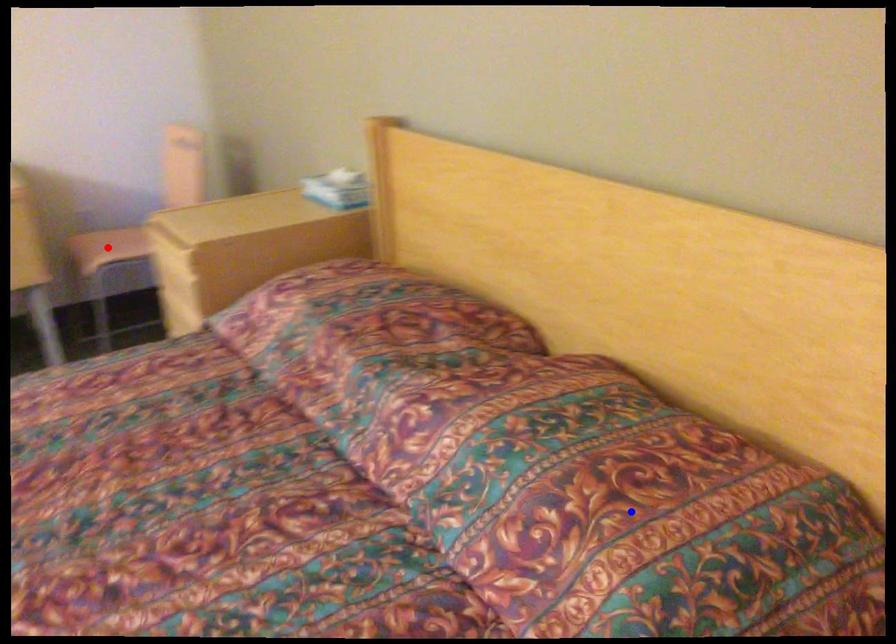
Question: Two points are marked on the image. Which point is closer to the camera?

Choices:
 (A) Blue point is closer.
 (B) Red point is closer.

Answer: (A)